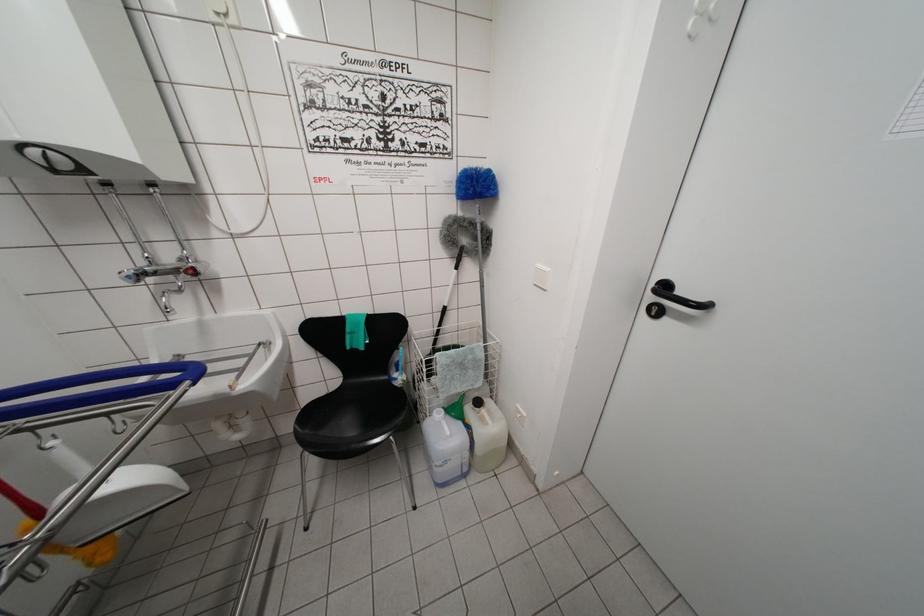
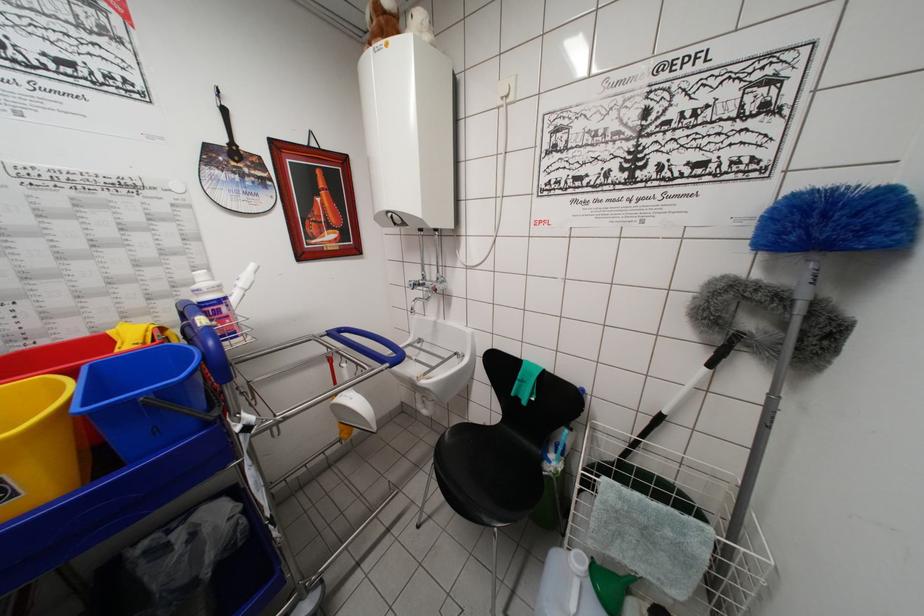
Find the pixel in the second image that matches (234,392) in the first image.

(420, 383)